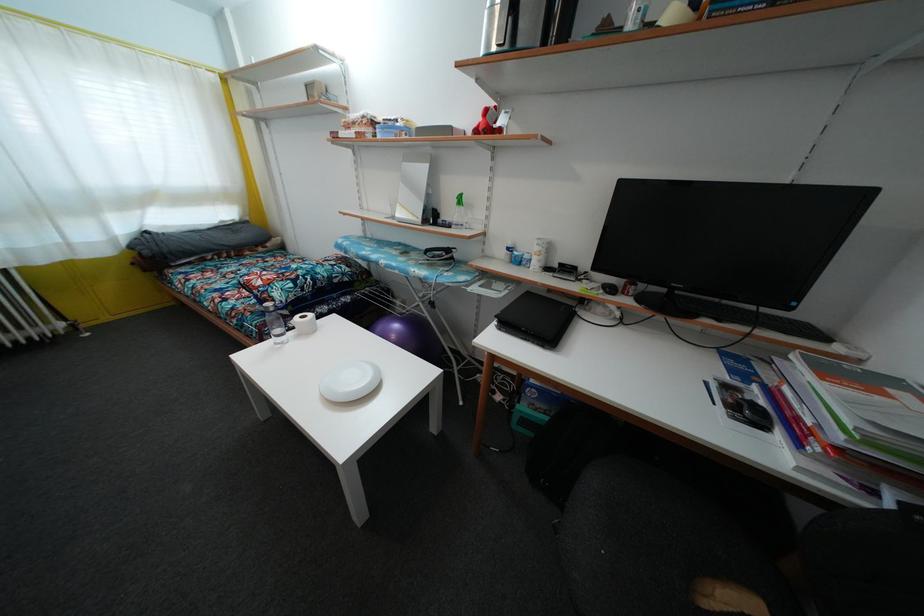
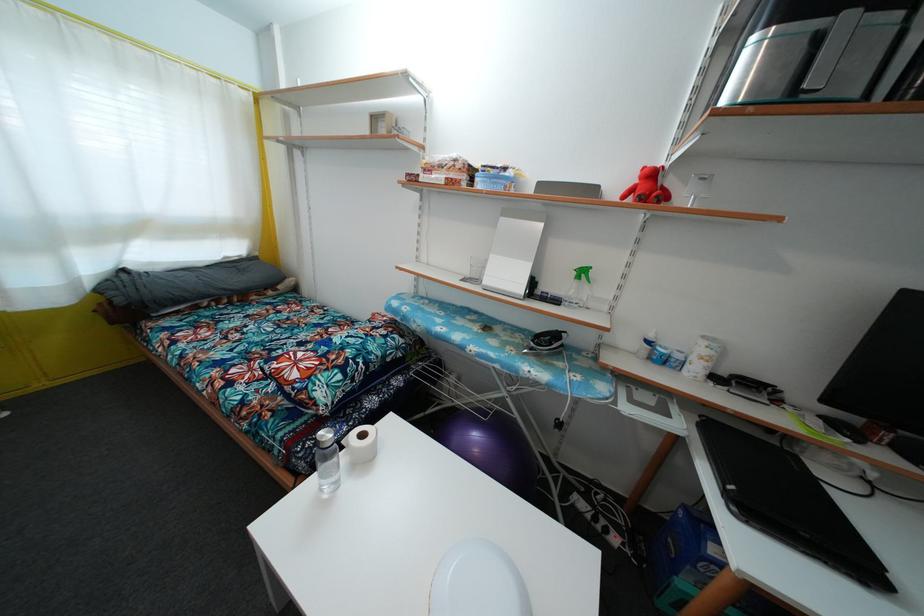
Based on the photo, the images are taken continuously from a first-person perspective. In which direction are you moving?

The movement direction of the cameraman is left, forward.